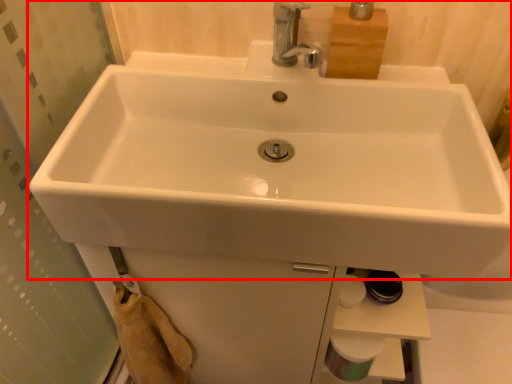
Question: From the image's perspective, considering the relative positions of sink (annotated by the red box) and toilet paper in the image provided, where is sink (annotated by the red box) located with respect to the staircase?

Choices:
 (A) below
 (B) above

Answer: (B)